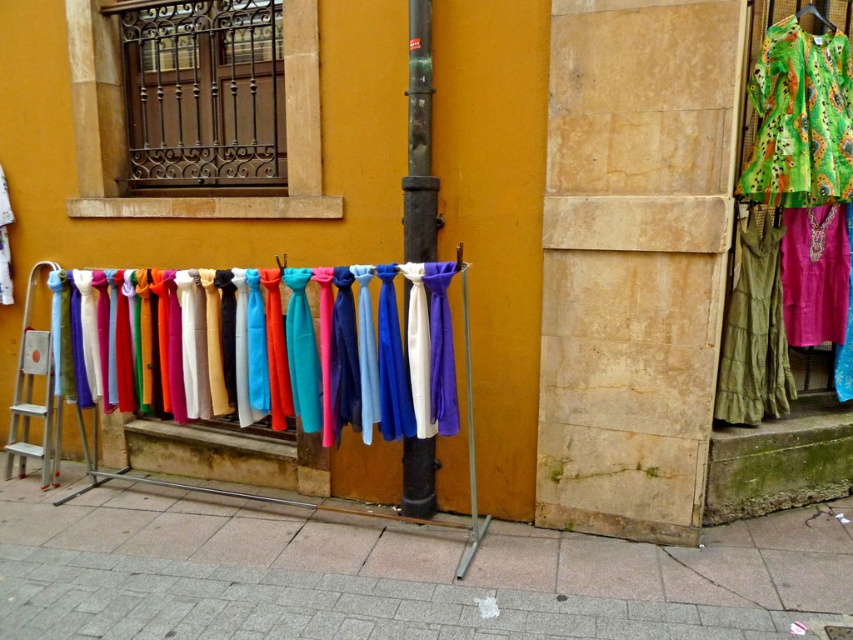
Between satin scarves at center and vibrant pink fabric at center, which one has more height?

With more height is satin scarves at center.

Who is higher up, satin scarves at center or vibrant pink fabric at center?

Positioned higher is vibrant pink fabric at center.

Is point (50, 284) positioned in front of point (822, 218)?

No, it is not.

I want to click on satin scarves at center, so click(x=128, y=342).

Does point (788, 173) come farther from viewer compared to point (756, 248)?

No, (788, 173) is in front of (756, 248).

Which is above, green paisley fabric dress at upper right or green textured dress at right?

green paisley fabric dress at upper right is higher up.

Is point (819, 120) farther from camera compared to point (728, 330)?

No, it is in front of (728, 330).

Where is `green paisley fabric dress at upper right`? The image size is (853, 640). green paisley fabric dress at upper right is located at coordinates (799, 118).

Between satin scarves at center and green textured dress at right, which one is positioned lower?

satin scarves at center is below.

Does point (113, 298) come closer to viewer compared to point (747, 310)?

No, (113, 298) is further to viewer.

Who is more forward, (287, 278) or (755, 355)?

Point (287, 278)

Locate an element on the screen. satin scarves at center is located at coordinates (128, 342).